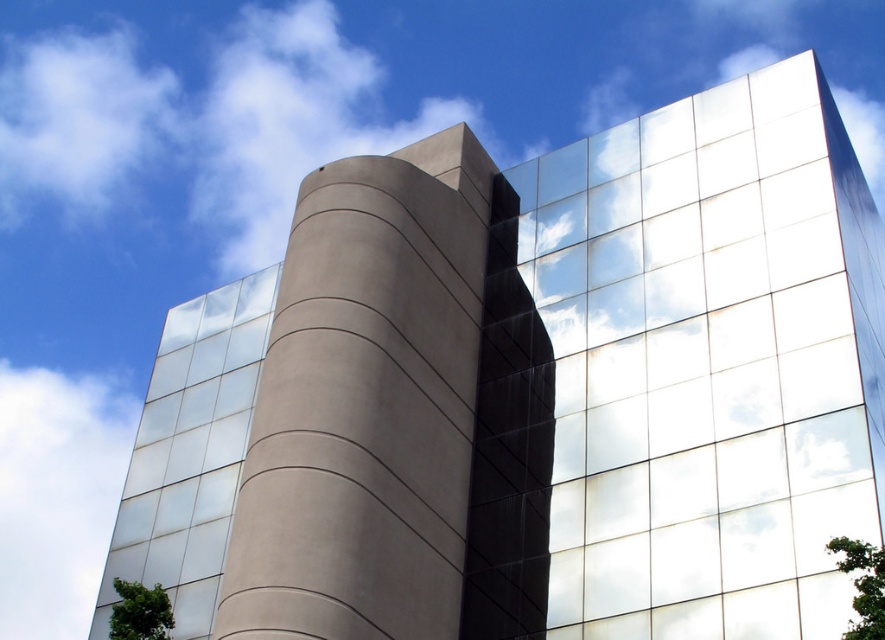
Is point (43, 406) closer to viewer compared to point (124, 634)?

No, (43, 406) is further to viewer.

Is white fluffy cloud at upper left shorter than green leafy tree at lower left?

In fact, white fluffy cloud at upper left may be taller than green leafy tree at lower left.

Image resolution: width=885 pixels, height=640 pixels. Identify the location of white fluffy cloud at upper left. (58, 496).

Where is `white fluffy cloud at upper left`? The height and width of the screenshot is (640, 885). white fluffy cloud at upper left is located at coordinates (58, 496).

Is satin glass windows at left further to camera compared to green leafy tree at lower left?

Yes, it is.

Does point (179, 417) come closer to viewer compared to point (122, 616)?

No, (179, 417) is behind (122, 616).

Which is behind, point (197, 529) or point (137, 604)?

The point (197, 529) is more distant.

Identify the location of satin glass windows at left. (190, 452).

Between point (160, 342) and point (120, 436), which one is positioned in front?

Point (160, 342) is in front.

Which is in front, point (204, 531) or point (45, 508)?

Point (204, 531)

This screenshot has width=885, height=640. In order to click on satin glass windows at left in this screenshot , I will do `click(190, 452)`.